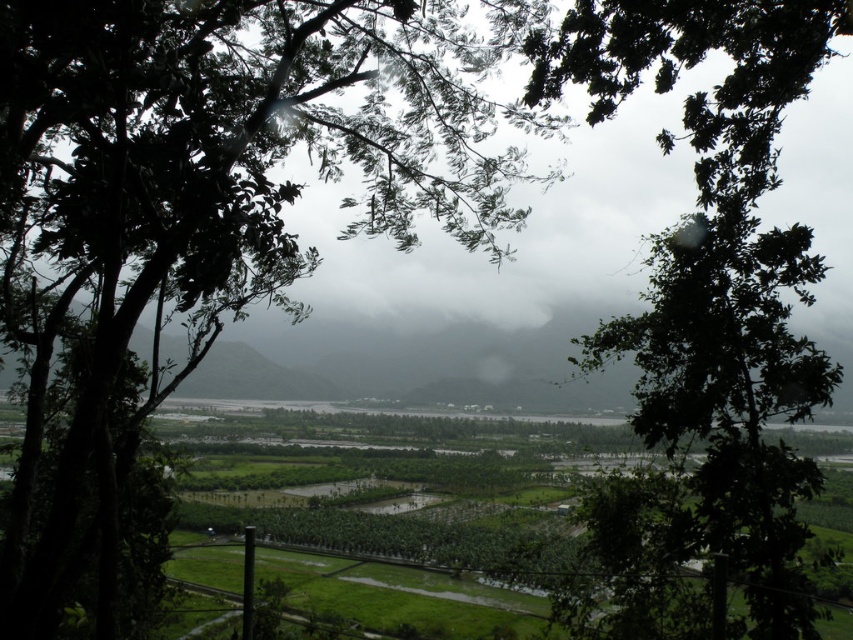
Question: Which object appears farthest from the camera in this image?

Choices:
 (A) green leafy tree at upper center
 (B) green leafy tree at center

Answer: (A)

Question: Is the position of green leafy tree at center more distant than that of green leafy tree at upper center?

Choices:
 (A) yes
 (B) no

Answer: (B)

Question: Which object is farther from the camera taking this photo?

Choices:
 (A) green leafy tree at upper center
 (B) green leafy tree at center

Answer: (A)

Question: Which object appears closest to the camera in this image?

Choices:
 (A) green leafy tree at upper center
 (B) green leafy tree at center

Answer: (B)

Question: Is green leafy tree at center positioned in front of green leafy tree at upper center?

Choices:
 (A) yes
 (B) no

Answer: (A)

Question: Does green leafy tree at center come in front of green leafy tree at upper center?

Choices:
 (A) no
 (B) yes

Answer: (B)